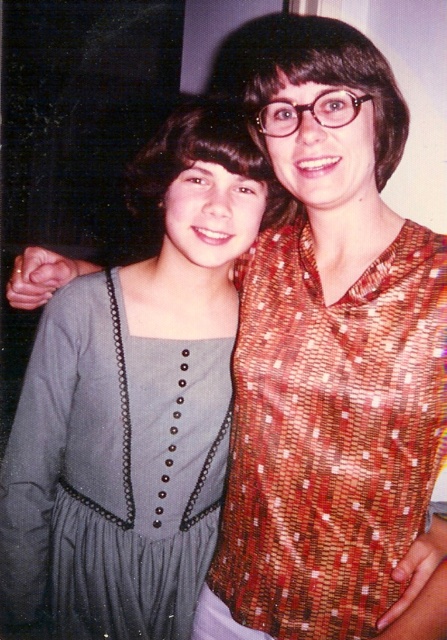
Question: Is shiny brown blouse at center to the right of gray textured fabric dress at center from the viewer's perspective?

Choices:
 (A) no
 (B) yes

Answer: (B)

Question: Which object appears farthest from the camera in this image?

Choices:
 (A) shiny brown blouse at center
 (B) gray textured fabric dress at center

Answer: (B)

Question: Does shiny brown blouse at center appear on the right side of gray textured fabric dress at center?

Choices:
 (A) no
 (B) yes

Answer: (B)

Question: Which of the following is the farthest from the observer?

Choices:
 (A) gray textured fabric dress at center
 (B) shiny brown blouse at center

Answer: (A)

Question: Among these points, which one is farthest from the camera?

Choices:
 (A) (110, 317)
 (B) (268, 435)

Answer: (A)

Question: Can you confirm if shiny brown blouse at center is thinner than gray textured fabric dress at center?

Choices:
 (A) yes
 (B) no

Answer: (A)